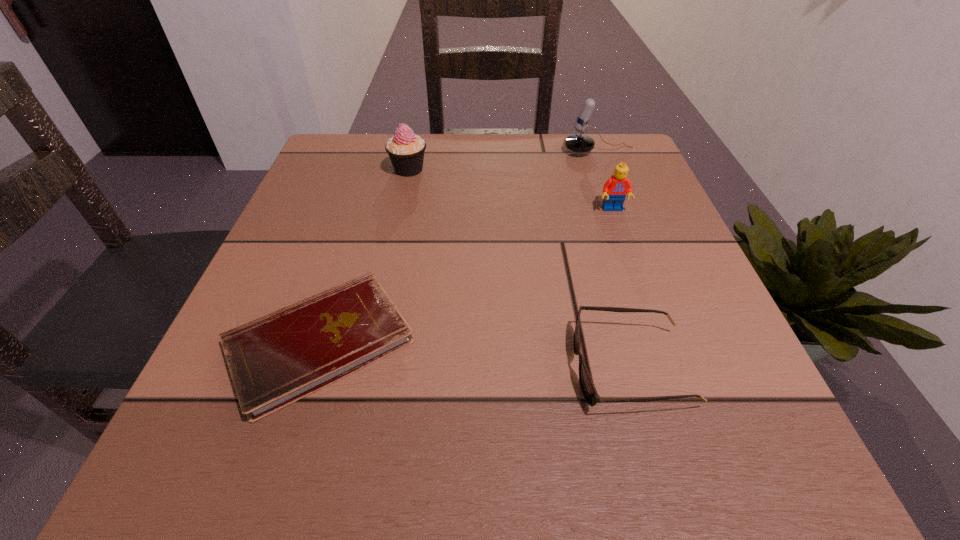
Locate an element on the screen. vacant space that is in between the fourth tallest object and the cupcake is located at coordinates (519, 268).

Locate an element on the screen. Image resolution: width=960 pixels, height=540 pixels. free point between the notebook and the third farthest object is located at coordinates (467, 276).

Where is `empty location between the fourth nearest object and the farthest object`? Image resolution: width=960 pixels, height=540 pixels. empty location between the fourth nearest object and the farthest object is located at coordinates (504, 160).

This screenshot has width=960, height=540. Identify the location of vacant area that lies between the notebook and the second shortest object. tap(475, 355).

In order to click on vacant space that is in between the microphone and the sunglasses in this screenshot , I will do `click(615, 260)`.

Find the location of a particular element. The width and height of the screenshot is (960, 540). unoccupied area between the fourth tallest object and the farthest object is located at coordinates (615, 260).

Find the location of `vacant area that lies between the shortest object and the microphone`. vacant area that lies between the shortest object and the microphone is located at coordinates (460, 247).

Where is `empty space that is in between the notebook and the cupcake`? Image resolution: width=960 pixels, height=540 pixels. empty space that is in between the notebook and the cupcake is located at coordinates (364, 256).

Identify which object is the fourth nearest to the fourth nearest object. Please provide its 2D coordinates. Your answer should be formatted as a tuple, i.e. [(x, y)], where the tuple contains the x and y coordinates of a point satisfying the conditions above.

[(590, 394)]

Image resolution: width=960 pixels, height=540 pixels. Find the location of `object that stands as the third closest to the Lego`. object that stands as the third closest to the Lego is located at coordinates (406, 150).